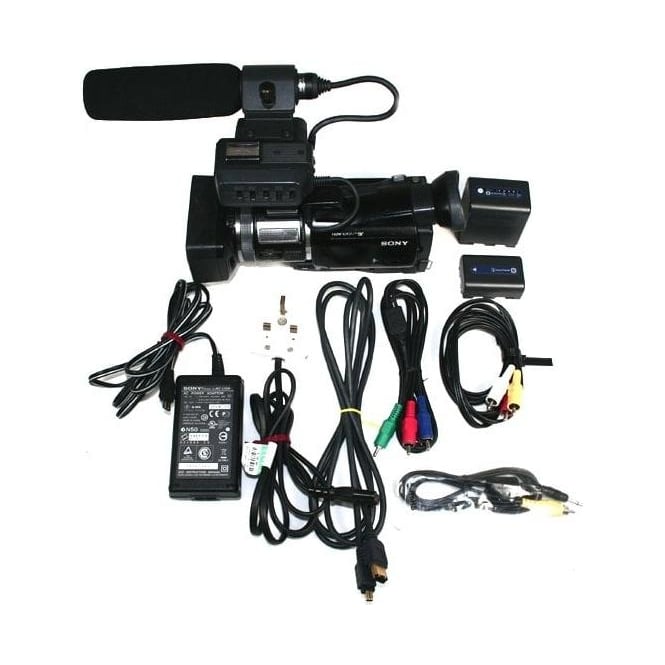
Find the location of a particular element. This screenshot has height=665, width=665. red blue and green plugs is located at coordinates (422, 427), (409, 425), (388, 431).